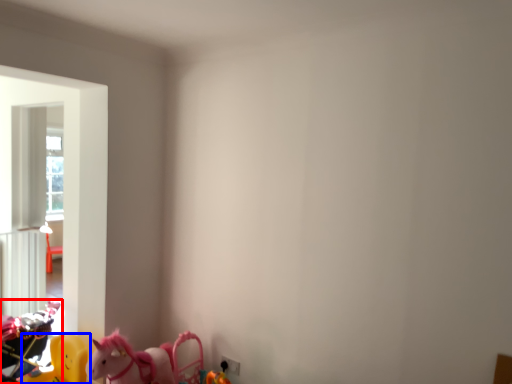
Question: Which of the following is the closest to the observer, toy (highlighted by a red box) or toy (highlighted by a blue box)?

Choices:
 (A) toy
 (B) toy

Answer: (B)